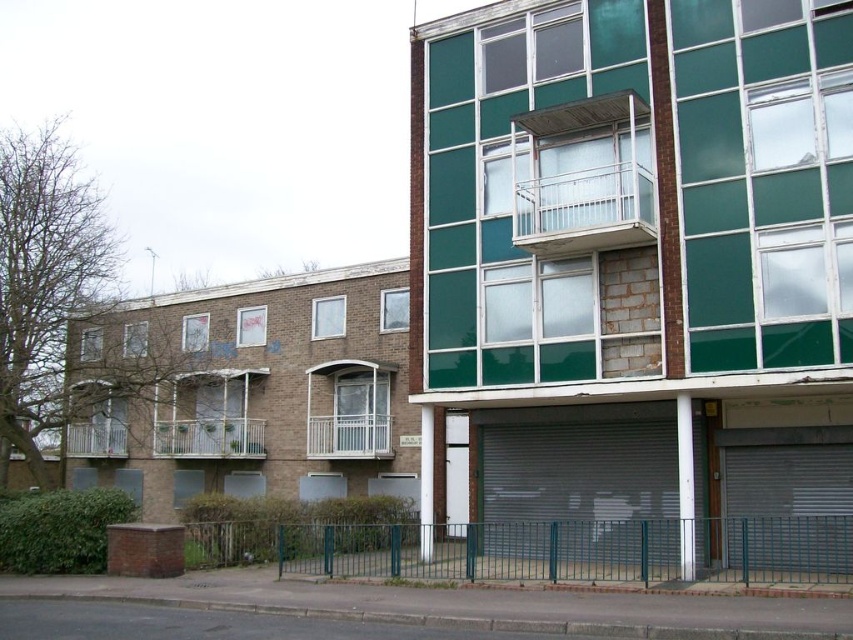
You are a painter who needs to choose between two white metal balconies to paint. The white metal balcony at upper center and the white metal balcony at lower left. Which one has a smaller width that might require a smaller paintbrush?

The white metal balcony at upper center is thinner than the white metal balcony at lower left, so it has a smaller width and would require a smaller paintbrush.